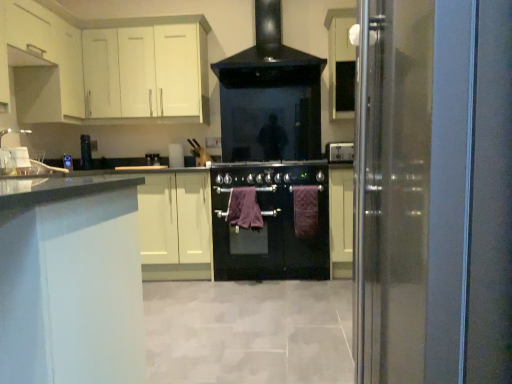
In order to face purple cotton towel at center, the second blanket positioned from the right, should I rotate leftwards or rightwards?

Rotate left and turn 1.669 degrees.

Find the location of `purple fabric towel at center, arranged as the second blanket when viewed from the left`. purple fabric towel at center, arranged as the second blanket when viewed from the left is located at coordinates (305, 210).

You are a GUI agent. You are given a task and a screenshot of the screen. Output one action in this format:
    pyautogui.click(x=<x>, y=<y>)
    Task: Click on the white matte cabinet at upper left, arranged as the first cabinetry when viewed from the front
    
    Given the screenshot: What is the action you would take?
    pyautogui.click(x=42, y=63)

Measure the distance between white matte cabinet at upper left, the first cabinetry in the left-to-right sequence, and camera.

8.27 feet.

The image size is (512, 384). I want to click on satin black knife block at center, positioned as the 1th appliance in back-to-front order, so click(152, 159).

Where is `black glass oven at center`? The width and height of the screenshot is (512, 384). black glass oven at center is located at coordinates (271, 220).

Between satin silver power outlet at upper right, acting as the 1th appliance starting from the right, and white matte cabinet at upper left, arranged as the first cabinetry when viewed from the front, which one appears on the right side from the viewer's perspective?

From the viewer's perspective, satin silver power outlet at upper right, acting as the 1th appliance starting from the right, appears more on the right side.

Considering the positions of points (331, 151) and (0, 4), is point (331, 151) farther from camera compared to point (0, 4)?

That is True.

From a real-world perspective, does satin silver power outlet at upper right, acting as the first appliance starting from the front, stand above white matte cabinet at upper left, which is the second cabinetry in right-to-left order?

No, from a real-world perspective, satin silver power outlet at upper right, acting as the first appliance starting from the front, is not over white matte cabinet at upper left, which is the second cabinetry in right-to-left order

Is satin silver power outlet at upper right, placed as the 2th appliance when sorted from left to right, facing away from white matte cabinet at upper left, arranged as the first cabinetry when viewed from the front?

That's not correct — satin silver power outlet at upper right, placed as the 2th appliance when sorted from left to right, is not looking away from white matte cabinet at upper left, arranged as the first cabinetry when viewed from the front.

Is purple cotton towel at center, the second blanket positioned from the right, at the left side of transparent glass door at right?

Yes.

Is purple cotton towel at center, the second blanket positioned from the right, taller or shorter than transparent glass door at right?

Considering their sizes, purple cotton towel at center, the second blanket positioned from the right, has less height than transparent glass door at right.

Which is closer to the camera, [229,211] or [381,383]?

Clearly, point [229,211] is more distant from the camera than point [381,383].

Can you see purple cotton towel at center, which is counted as the first blanket, starting from the left, touching satin silver power outlet at upper right, which is the 2th appliance from back to front?

No, purple cotton towel at center, which is counted as the first blanket, starting from the left, is not in contact with satin silver power outlet at upper right, which is the 2th appliance from back to front.

Does purple cotton towel at center, which is counted as the first blanket, starting from the left, turn towards satin silver power outlet at upper right, acting as the 1th appliance starting from the right?

No, purple cotton towel at center, which is counted as the first blanket, starting from the left, is not aimed at satin silver power outlet at upper right, acting as the 1th appliance starting from the right.

Considering the sizes of purple cotton towel at center, which is counted as the first blanket, starting from the left, and satin silver power outlet at upper right, which is the 2th appliance from back to front, in the image, is purple cotton towel at center, which is counted as the first blanket, starting from the left, bigger or smaller than satin silver power outlet at upper right, which is the 2th appliance from back to front,?

In the image, purple cotton towel at center, which is counted as the first blanket, starting from the left, appears to be larger than satin silver power outlet at upper right, which is the 2th appliance from back to front.

From a real-world perspective, which object stands above the other?

From a 3D spatial view, black glossy range hood at upper center is above.

Can you confirm if purple cotton towel at center, the second blanket positioned from the right, is positioned to the right of black glossy range hood at upper center?

Incorrect, purple cotton towel at center, the second blanket positioned from the right, is not on the right side of black glossy range hood at upper center.

Does purple cotton towel at center, which is counted as the first blanket, starting from the left, turn towards black glossy range hood at upper center?

No, purple cotton towel at center, which is counted as the first blanket, starting from the left, is not facing towards black glossy range hood at upper center.

From the image's perspective, is purple cotton towel at center, which is counted as the first blanket, starting from the left, on black glossy range hood at upper center?

No, from the image's perspective, purple cotton towel at center, which is counted as the first blanket, starting from the left, is not above black glossy range hood at upper center.

Which of these two, purple fabric towel at center, the first blanket when ordered from right to left, or satin black knife block at center, the 2th appliance from the right, stands shorter?

With less height is satin black knife block at center, the 2th appliance from the right.

Can you confirm if purple fabric towel at center, arranged as the second blanket when viewed from the left, is smaller than satin black knife block at center, which appears as the second appliance when viewed from the front?

No, purple fabric towel at center, arranged as the second blanket when viewed from the left, is not smaller than satin black knife block at center, which appears as the second appliance when viewed from the front.

From a real-world perspective, which is physically above, purple fabric towel at center, arranged as the second blanket when viewed from the left, or satin black knife block at center, the 2th appliance from the right?

satin black knife block at center, the 2th appliance from the right, is physically above.

At what (x,y) coordinates should I click in order to perform the action: click on home appliance above the satin black knife block at center, the 1th appliance positioned from the left (from the image's perspective). Please return your answer as a coordinate pair (x, y). This screenshot has height=384, width=512. Looking at the image, I should click on (268, 57).

Is point (238, 84) positioned in front of point (156, 163)?

No.

From a real-world perspective, which is physically above, black glossy range hood at upper center or satin black knife block at center, the 2th appliance from the right?

In real-world perspective, black glossy range hood at upper center is above.

Could you tell me if black glossy range hood at upper center is facing satin black knife block at center, the 2th appliance from the right?

No, black glossy range hood at upper center does not turn towards satin black knife block at center, the 2th appliance from the right.

Where is `blanket that is the 1st object located below the satin silver power outlet at upper right, which is the 2th appliance from back to front (from the image's perspective)`? blanket that is the 1st object located below the satin silver power outlet at upper right, which is the 2th appliance from back to front (from the image's perspective) is located at coordinates (244, 209).

Is satin silver power outlet at upper right, acting as the first appliance starting from the front, wider or thinner than purple cotton towel at center, which is counted as the first blanket, starting from the left?

Clearly, satin silver power outlet at upper right, acting as the first appliance starting from the front, has more width compared to purple cotton towel at center, which is counted as the first blanket, starting from the left.

Between satin silver power outlet at upper right, acting as the first appliance starting from the front, and purple cotton towel at center, the second blanket positioned from the right, which one appears on the right side from the viewer's perspective?

→ From the viewer's perspective, satin silver power outlet at upper right, acting as the first appliance starting from the front, appears more on the right side.

From a real-world perspective, count 1st cabinetrys upward from the satin silver power outlet at upper right, acting as the 1th appliance starting from the right, and point to it. Please provide its 2D coordinates.

[(42, 63)]

From the image's perspective, starting from the transparent glass door at right, which blanket is the 1st one below? Please provide its 2D coordinates.

[(244, 209)]

From the image, which object appears to be nearer to transparent glass door at right, purple cotton towel at center, which is counted as the first blanket, starting from the left, or satin silver power outlet at upper right, which is the 2th appliance from back to front?

purple cotton towel at center, which is counted as the first blanket, starting from the left, is closer to transparent glass door at right.

Estimate the real-world distances between objects in this image. Which object is closer to purple fabric towel at center, the first blanket when ordered from right to left, black glossy range hood at upper center or satin silver power outlet at upper right, acting as the 1th appliance starting from the right?

Among the two, satin silver power outlet at upper right, acting as the 1th appliance starting from the right, is located nearer to purple fabric towel at center, the first blanket when ordered from right to left.

Estimate the real-world distances between objects in this image. Which object is closer to purple fabric towel at center, arranged as the second blanket when viewed from the left, black glass oven at center or white matte cabinet at upper left, which ranks as the 2th cabinetry in left-to-right order?

black glass oven at center is positioned closer to the anchor purple fabric towel at center, arranged as the second blanket when viewed from the left.

Estimate the real-world distances between objects in this image. Which object is closer to satin silver power outlet at upper right, acting as the first appliance starting from the front, transparent glass door at right or black glossy range hood at upper center?

Based on the image, black glossy range hood at upper center appears to be nearer to satin silver power outlet at upper right, acting as the first appliance starting from the front.

From the image, which object appears to be farther from white matte cabinet at upper left, which appears as the second cabinetry when viewed from the front, purple cotton towel at center, the second blanket positioned from the right, or black glass oven at center?

Based on the image, purple cotton towel at center, the second blanket positioned from the right, appears to be further to white matte cabinet at upper left, which appears as the second cabinetry when viewed from the front.

When comparing their distances from satin black knife block at center, positioned as the 1th appliance in back-to-front order, does purple cotton towel at center, the second blanket positioned from the right, or white matte cabinet at upper left, which appears as the second cabinetry when viewed from the front, seem closer?

white matte cabinet at upper left, which appears as the second cabinetry when viewed from the front.

Which object lies further to the anchor point black glass oven at center, white matte cabinet at upper left, which is the second cabinetry in back-to-front order, or purple cotton towel at center, the second blanket positioned from the right?

white matte cabinet at upper left, which is the second cabinetry in back-to-front order, is further to black glass oven at center.

From the picture: Looking at the image, which one is located further to purple cotton towel at center, which is counted as the first blanket, starting from the left, black glass oven at center or white matte cabinet at upper left, the first cabinetry in the left-to-right sequence?

white matte cabinet at upper left, the first cabinetry in the left-to-right sequence.

In order to click on cabinetry between transparent glass door at right and black glass oven at center along the z-axis in this screenshot , I will do `click(42, 63)`.

I want to click on cabinetry between white matte cabinet at upper left, which is the second cabinetry in right-to-left order, and purple fabric towel at center, the first blanket when ordered from right to left, in the horizontal direction, so click(x=106, y=66).

The height and width of the screenshot is (384, 512). Identify the location of home appliance between transparent glass door at right and satin black knife block at center, positioned as the 1th appliance in back-to-front order, from front to back. (268, 57).

At what (x,y) coordinates should I click in order to perform the action: click on home appliance situated between white matte cabinet at upper left, which is the second cabinetry in right-to-left order, and black glass oven at center from left to right. Please return your answer as a coordinate pair (x, y). Looking at the image, I should click on (268, 57).